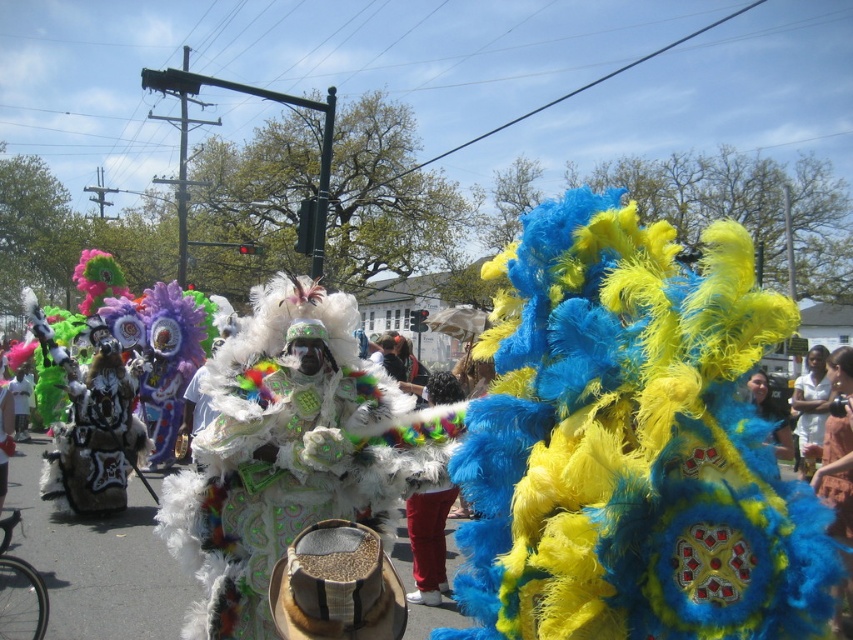
Question: Does red cotton pants at center appear on the right side of white cotton shirt at right?

Choices:
 (A) yes
 (B) no

Answer: (B)

Question: Can you confirm if white cotton shirt at right is smaller than matte blue feathered headdress at center?

Choices:
 (A) yes
 (B) no

Answer: (B)

Question: Where is white cotton shirt at right located in relation to matte blue feathered headdress at center in the image?

Choices:
 (A) above
 (B) below

Answer: (B)

Question: Considering the real-world distances, which object is closest to the white cotton shirt at right?

Choices:
 (A) matte blue feathered headdress at center
 (B) red cotton pants at center

Answer: (A)

Question: Estimate the real-world distances between objects in this image. Which object is closer to the white cotton shirt at right?

Choices:
 (A) matte blue feathered headdress at center
 (B) red cotton pants at center

Answer: (A)

Question: Which object appears closest to the camera in this image?

Choices:
 (A) matte blue feathered headdress at center
 (B) white cotton shirt at right

Answer: (A)